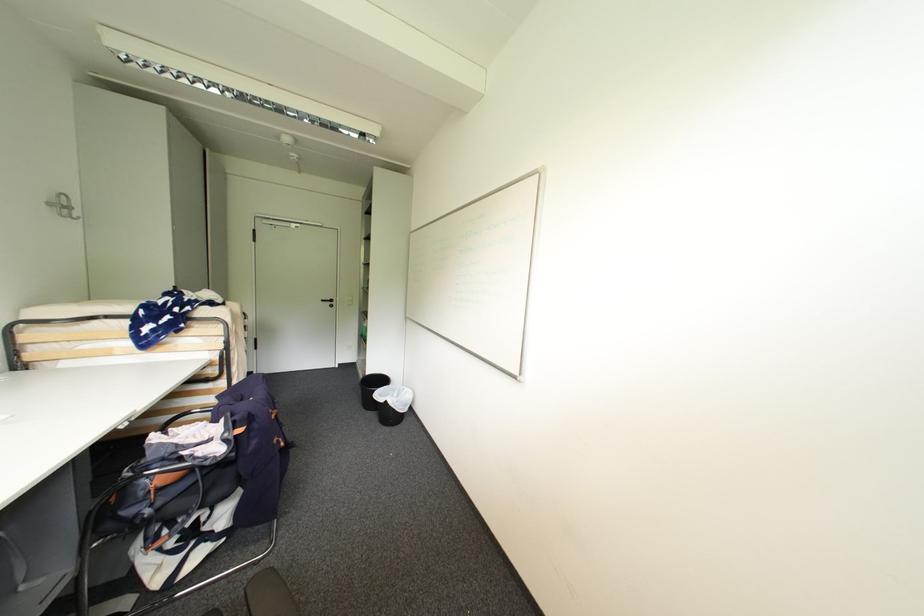
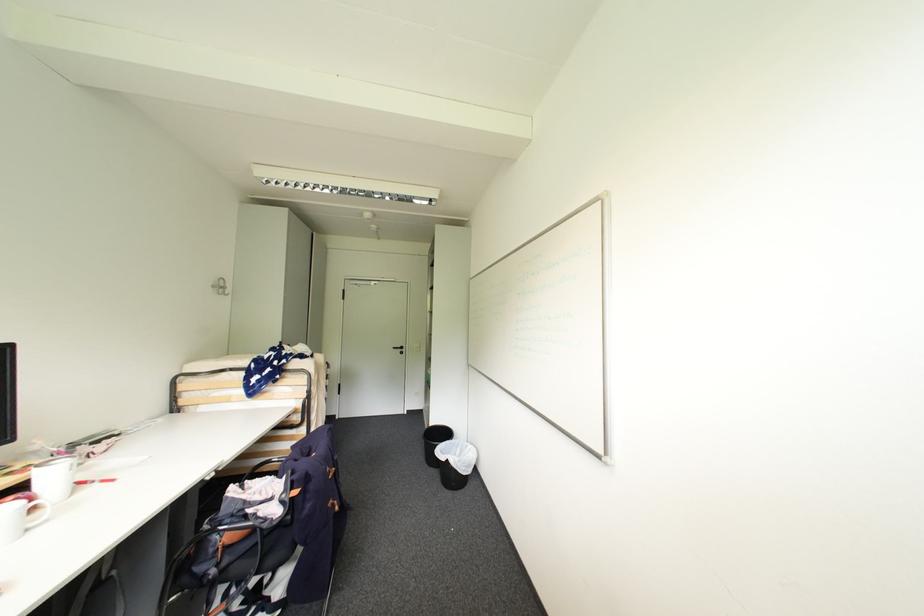
Where in the second image is the point corresponding to (55,205) from the first image?

(220, 286)